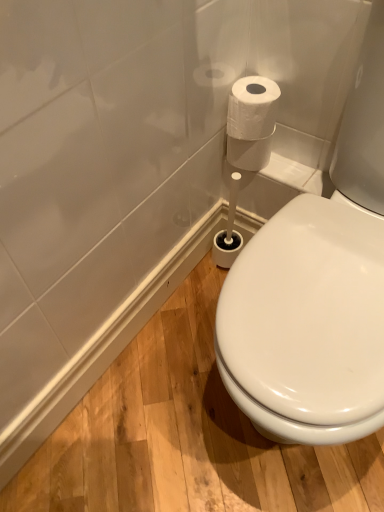
Locate an element on the screen. white paper at upper right is located at coordinates (252, 108).

This screenshot has width=384, height=512. What do you see at coordinates (252, 108) in the screenshot?
I see `white paper at upper right` at bounding box center [252, 108].

Identify the location of white paper at upper right. This screenshot has width=384, height=512. (252, 108).